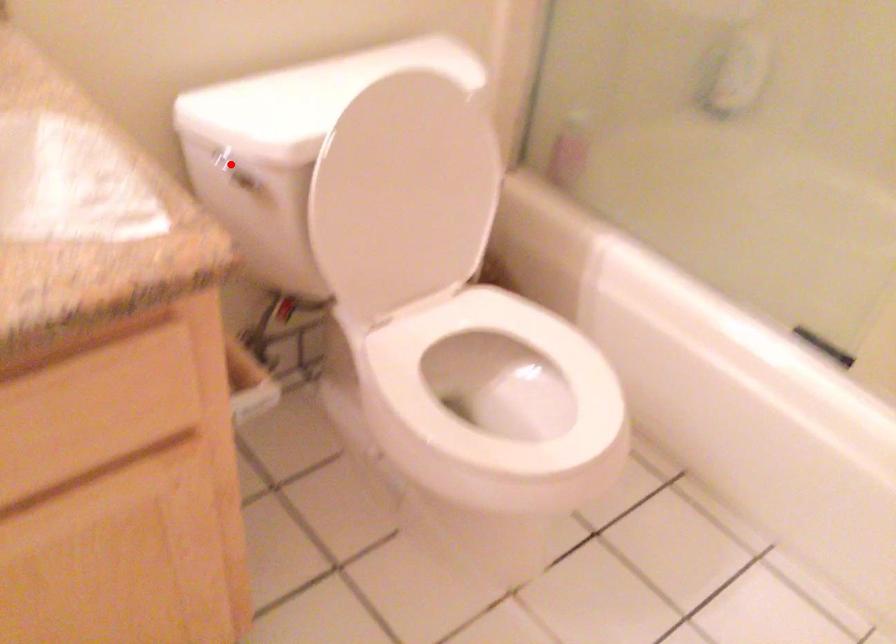
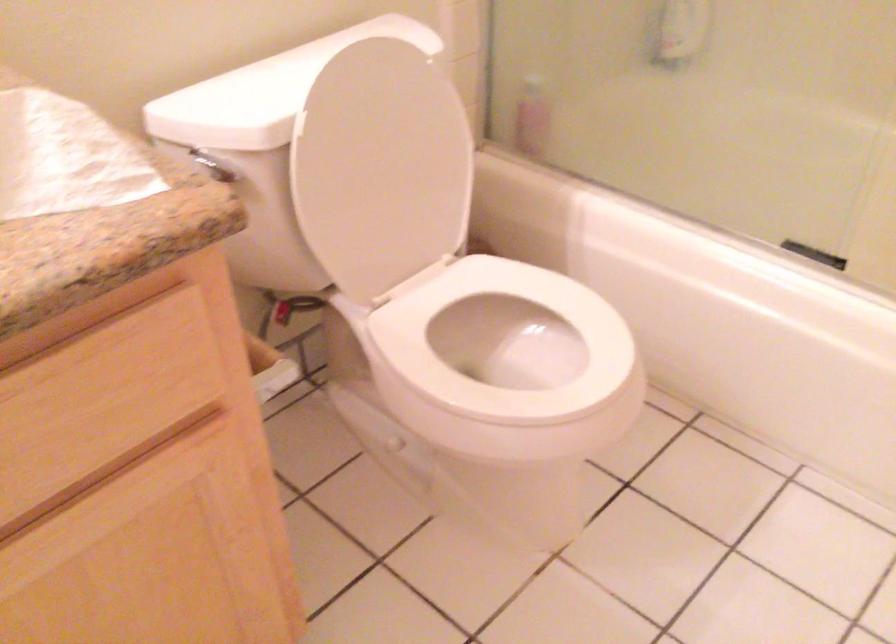
The point at the highlighted location is marked in the first image. Where is the corresponding point in the second image?

(209, 164)